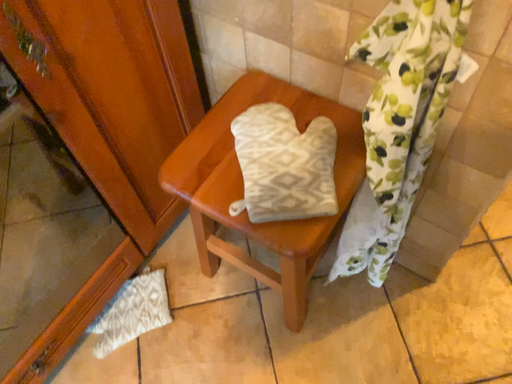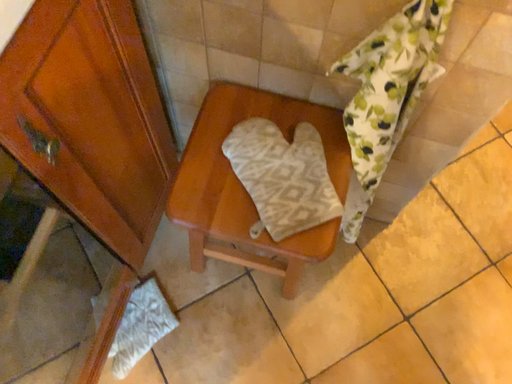
Question: Which way did the camera rotate in the video?

Choices:
 (A) rotated right
 (B) rotated left

Answer: (A)